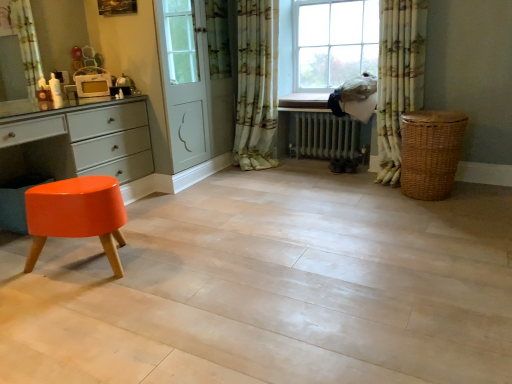
Question: Is white metallic radiator at center inside floral fabric curtain at center, which is the 2th curtain from right to left?

Choices:
 (A) no
 (B) yes

Answer: (A)

Question: From a real-world perspective, is floral fabric curtain at center, which is the 2th curtain from right to left, positioned over white metallic radiator at center based on gravity?

Choices:
 (A) no
 (B) yes

Answer: (B)

Question: Does floral fabric curtain at center, which is the 2th curtain from right to left, lie behind white metallic radiator at center?

Choices:
 (A) no
 (B) yes

Answer: (A)

Question: Considering the relative sizes of floral fabric curtain at center, which is the 2th curtain from right to left, and white metallic radiator at center in the image provided, is floral fabric curtain at center, which is the 2th curtain from right to left, smaller than white metallic radiator at center?

Choices:
 (A) no
 (B) yes

Answer: (A)

Question: Is floral fabric curtain at center, which is the 2th curtain from right to left, outside white metallic radiator at center?

Choices:
 (A) yes
 (B) no

Answer: (A)

Question: From the image's perspective, does floral fabric curtain at center, which is the 2th curtain from right to left, appear higher than white metallic radiator at center?

Choices:
 (A) yes
 (B) no

Answer: (A)

Question: Is floral fabric curtain at right, acting as the second curtain starting from the left, outside of white metallic radiator at center?

Choices:
 (A) yes
 (B) no

Answer: (A)

Question: From a real-world perspective, is floral fabric curtain at right, acting as the second curtain starting from the left, located higher than white metallic radiator at center?

Choices:
 (A) yes
 (B) no

Answer: (A)

Question: Is white metallic radiator at center completely or partially inside floral fabric curtain at right, which is the 1th curtain in right-to-left order?

Choices:
 (A) yes
 (B) no

Answer: (B)

Question: Is floral fabric curtain at right, acting as the second curtain starting from the left, oriented away from white metallic radiator at center?

Choices:
 (A) yes
 (B) no

Answer: (B)

Question: Considering the relative sizes of floral fabric curtain at right, acting as the second curtain starting from the left, and white metallic radiator at center in the image provided, is floral fabric curtain at right, acting as the second curtain starting from the left, taller than white metallic radiator at center?

Choices:
 (A) yes
 (B) no

Answer: (A)

Question: Can you confirm if floral fabric curtain at right, acting as the second curtain starting from the left, is bigger than white metallic radiator at center?

Choices:
 (A) no
 (B) yes

Answer: (B)

Question: Are glossy orange stool at lower left and white glossy microwave at upper left far apart?

Choices:
 (A) yes
 (B) no

Answer: (B)